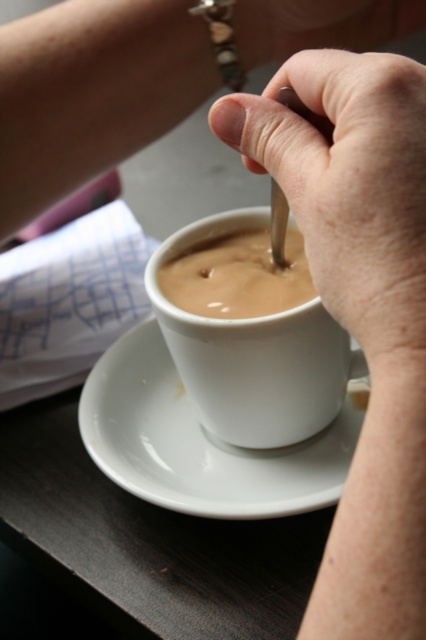
Consider the image. Does white glossy saucer at center lie in front of white matte cup at center?

No.

Is white glossy saucer at center above white matte cup at center?

Actually, white glossy saucer at center is below white matte cup at center.

Who is more distant from viewer, (100, 426) or (238, 403)?

The point (100, 426) is more distant.

Find the location of a particular element. The height and width of the screenshot is (640, 426). white glossy saucer at center is located at coordinates (201, 442).

Between white glossy saucer at center and matte ceramic cup at center, which one is positioned lower?

Positioned lower is white glossy saucer at center.

Is white glossy saucer at center smaller than matte ceramic cup at center?

Incorrect, white glossy saucer at center is not smaller in size than matte ceramic cup at center.

Is point (141, 470) positioned in front of point (264, 301)?

No.

Locate an element on the screen. white glossy saucer at center is located at coordinates (201, 442).

Between matte silver spoon at upper center and matte ceramic cup at center, which one has more height?

matte silver spoon at upper center is taller.

Is matte silver spoon at upper center smaller than matte ceramic cup at center?

Incorrect, matte silver spoon at upper center is not smaller in size than matte ceramic cup at center.

What do you see at coordinates (348, 184) in the screenshot?
I see `matte silver spoon at upper center` at bounding box center [348, 184].

Image resolution: width=426 pixels, height=640 pixels. Find the location of `matte silver spoon at upper center`. matte silver spoon at upper center is located at coordinates (348, 184).